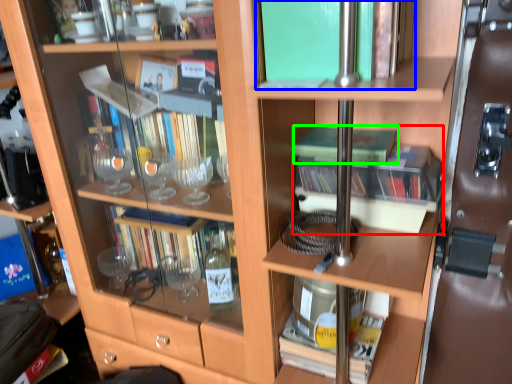
Question: Considering the real-world distances, which object is closest to book (highlighted by a red box)? book (highlighted by a blue box) or book (highlighted by a green box).

Choices:
 (A) book
 (B) book

Answer: (B)